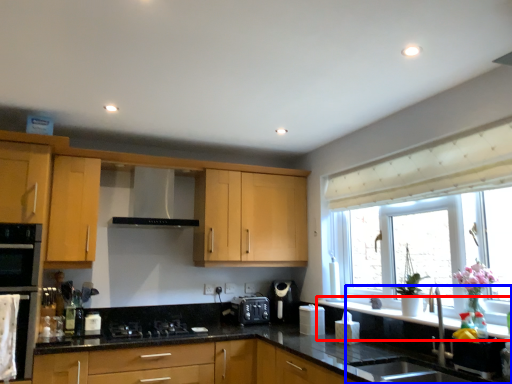
Question: Which of the following is the closest to the observer, window sill (highlighted by a red box) or sink (highlighted by a blue box)?

Choices:
 (A) window sill
 (B) sink

Answer: (B)